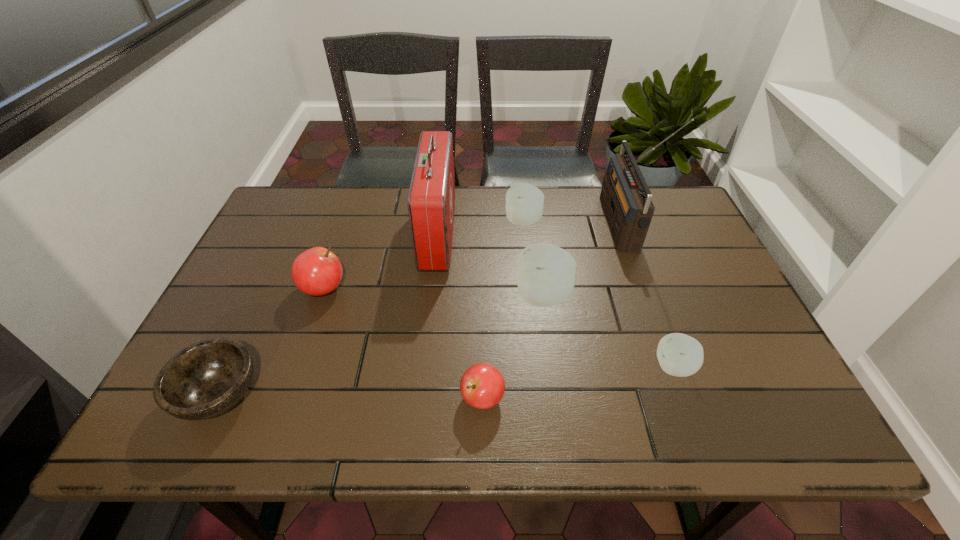
The image size is (960, 540). What are the coordinates of `free spot between the tallest object and the bowl` in the screenshot? It's located at (420, 310).

Find the location of a particular element. Image resolution: width=960 pixels, height=540 pixels. free space between the radio receiver and the nearer red apple is located at coordinates [551, 312].

Where is `vacant space in between the second nearest white apple and the bowl`? vacant space in between the second nearest white apple and the bowl is located at coordinates (381, 346).

Locate which object is the closest to the rightmost white apple. Please provide its 2D coordinates. Your answer should be formatted as a tuple, i.e. [(x, y)], where the tuple contains the x and y coordinates of a point satisfying the conditions above.

[(545, 276)]

You are a GUI agent. You are given a task and a screenshot of the screen. Output one action in this format:
    pyautogui.click(x=<x>, y=<y>)
    Task: Click on the fourth closest object to the right red apple
    
    Given the screenshot: What is the action you would take?
    pyautogui.click(x=317, y=271)

Locate an element on the screen. Image resolution: width=960 pixels, height=540 pixels. the third closest apple relative to the fourth apple from right to left is located at coordinates (317, 271).

This screenshot has width=960, height=540. What are the coordinates of `the third closest apple to the nearer red apple` in the screenshot? It's located at (317, 271).

I want to click on white apple that is the nearest to the farthest white apple, so click(545, 276).

The height and width of the screenshot is (540, 960). In order to click on white apple that is the second nearest to the second apple from left to right in this screenshot , I will do `click(680, 355)`.

Where is `vacant position in the image that satisfies the following two spatial constraints: 1. on the back side of the biggest white apple; 2. on the side of the red first-aid kit with the first aid cross symbol`? The height and width of the screenshot is (540, 960). vacant position in the image that satisfies the following two spatial constraints: 1. on the back side of the biggest white apple; 2. on the side of the red first-aid kit with the first aid cross symbol is located at coordinates (535, 234).